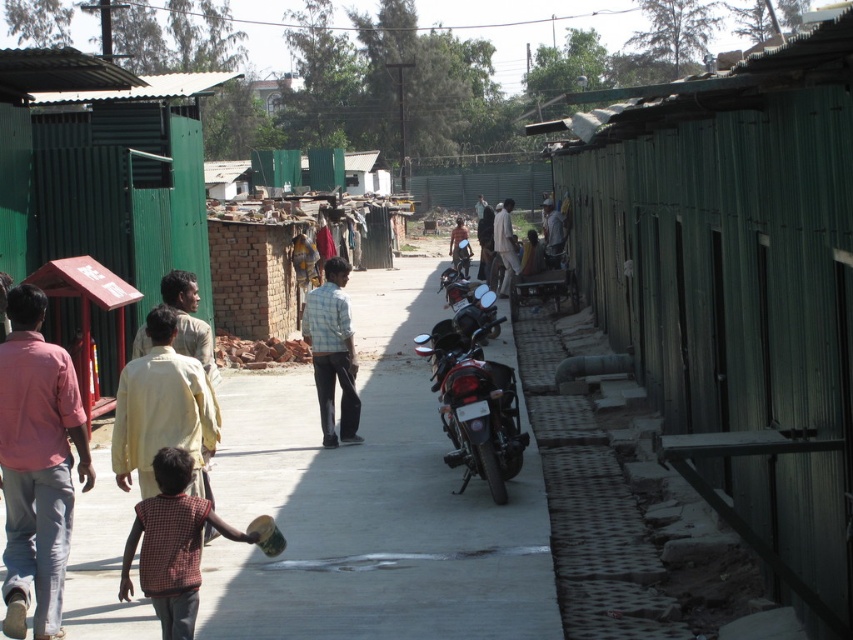
Question: Which object appears closest to the camera in this image?

Choices:
 (A) green corrugated metal hut at center
 (B) light blue checkered shirt at center
 (C) gray concrete pavement at center
 (D) matte pink shirt at left

Answer: (A)

Question: Is matte pink shirt at left closer to camera compared to shiny metallic motorcycle at center?

Choices:
 (A) yes
 (B) no

Answer: (A)

Question: Which of the following is the farthest from the observer?

Choices:
 (A) (495, 433)
 (B) (514, 266)
 (C) (178, 484)

Answer: (B)

Question: Does gray concrete pavement at center appear on the right side of light yellow fabric shirt at center-left?

Choices:
 (A) no
 (B) yes

Answer: (B)

Question: Can you confirm if shiny metallic motorcycle at center is positioned to the left of light blue checkered shirt at center?

Choices:
 (A) no
 (B) yes

Answer: (A)

Question: Which of these objects is positioned closest to the gray concrete pavement at center?

Choices:
 (A) light blue checkered shirt at center
 (B) green corrugated metal hut at center
 (C) checkered fabric shirt at lower left

Answer: (C)